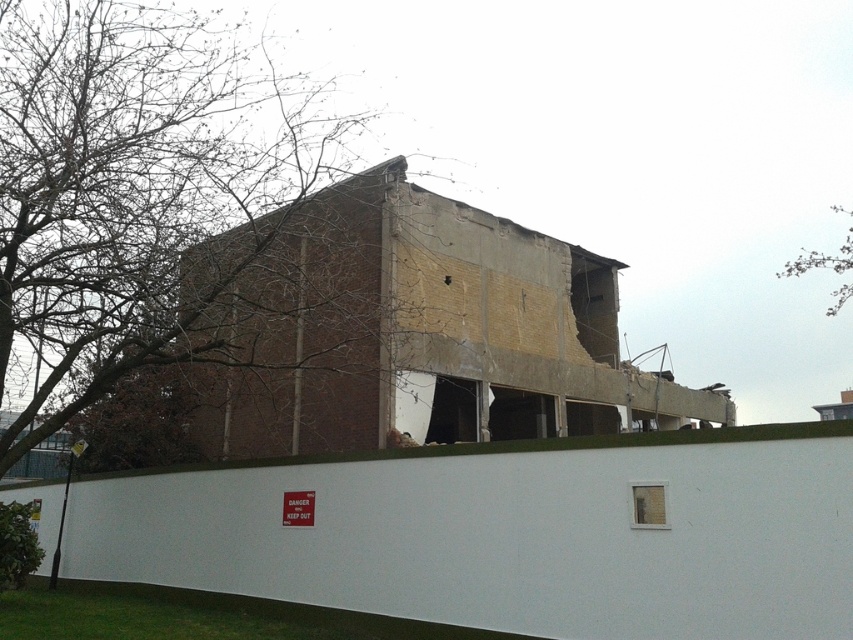
Question: Which object is farther from the camera taking this photo?

Choices:
 (A) bare branches at upper left
 (B) bare branches at upper right

Answer: (B)

Question: Which of the following is the closest to the observer?

Choices:
 (A) (799, 257)
 (B) (111, 141)

Answer: (B)

Question: Can you confirm if bare branches at upper left is bigger than bare branches at upper right?

Choices:
 (A) yes
 (B) no

Answer: (A)

Question: Does bare branches at upper left appear on the right side of bare branches at upper right?

Choices:
 (A) yes
 (B) no

Answer: (B)

Question: Is bare branches at upper left thinner than bare branches at upper right?

Choices:
 (A) no
 (B) yes

Answer: (A)